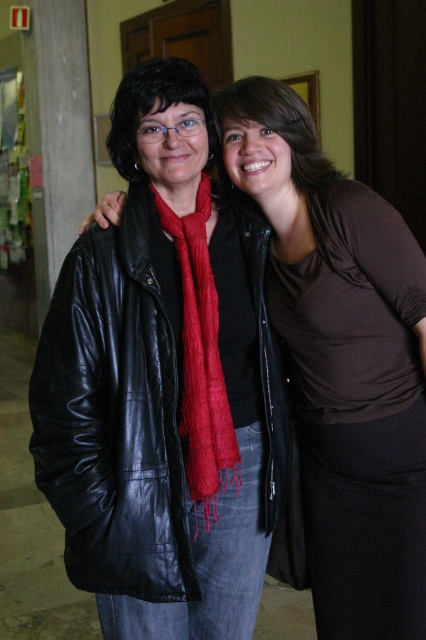
Question: Can you confirm if matte black leather jacket at left is bigger than matte black scarf at upper left?

Choices:
 (A) no
 (B) yes

Answer: (B)

Question: Can you confirm if matte black leather jacket at left is positioned below matte black scarf at upper left?

Choices:
 (A) yes
 (B) no

Answer: (A)

Question: Which point is farther to the camera?

Choices:
 (A) matte black leather jacket at left
 (B) black leather jacket at left

Answer: (A)

Question: Which of the following is the farthest from the observer?

Choices:
 (A) red knitted scarf at center
 (B) matte black scarf at upper left
 (C) black leather jacket at left
 (D) matte black leather jacket at left

Answer: (D)

Question: Is matte black leather jacket at left to the left of matte black scarf at upper left from the viewer's perspective?

Choices:
 (A) no
 (B) yes

Answer: (A)

Question: Estimate the real-world distances between objects in this image. Which object is farther from the matte black leather jacket at left?

Choices:
 (A) red knitted scarf at center
 (B) matte black scarf at upper left

Answer: (B)